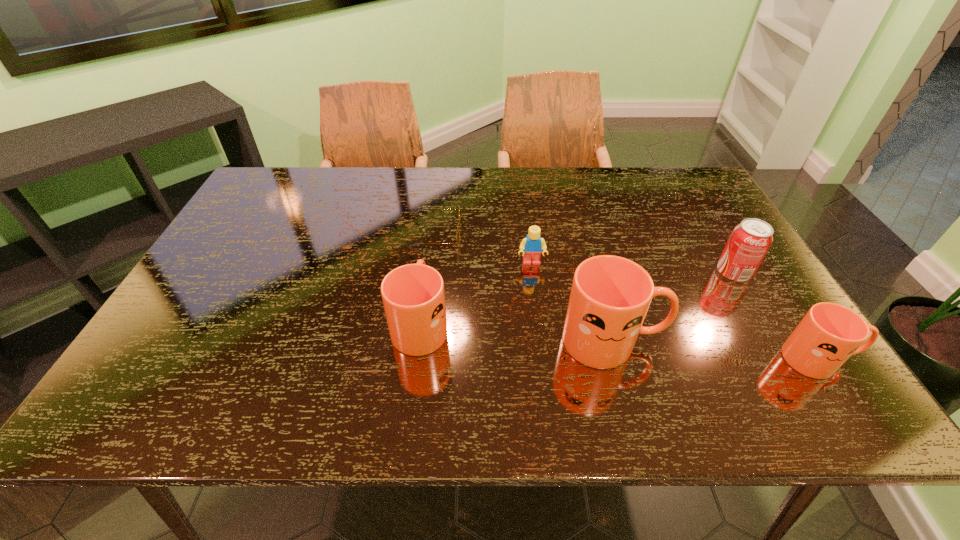
I want to click on the leftmost mug, so click(x=413, y=295).

Identify the location of the tallest mug. 610,295.

Where is `the second mug from left to right`? the second mug from left to right is located at coordinates (610, 295).

Identify the location of the rightmost mug. The width and height of the screenshot is (960, 540). (826, 337).

What are the coordinates of `the shortest object` in the screenshot? It's located at (458, 227).

Locate an element on the screen. Image resolution: width=960 pixels, height=540 pixels. the farthest object is located at coordinates (458, 227).

Image resolution: width=960 pixels, height=540 pixels. Find the location of `Lego`. Lego is located at coordinates (533, 244).

In order to click on soda in this screenshot , I will do `click(750, 240)`.

You are a GUI agent. You are given a task and a screenshot of the screen. Output one action in this format:
    pyautogui.click(x=<x>, y=<y>)
    Task: Click on the vacant region located 0.070m on the handle side of the second tallest mug
    The height and width of the screenshot is (540, 960).
    Given the screenshot: What is the action you would take?
    pyautogui.click(x=426, y=275)

The width and height of the screenshot is (960, 540). I want to click on vacant space located 0.150m on the handle side of the second tallest mug, so click(429, 255).